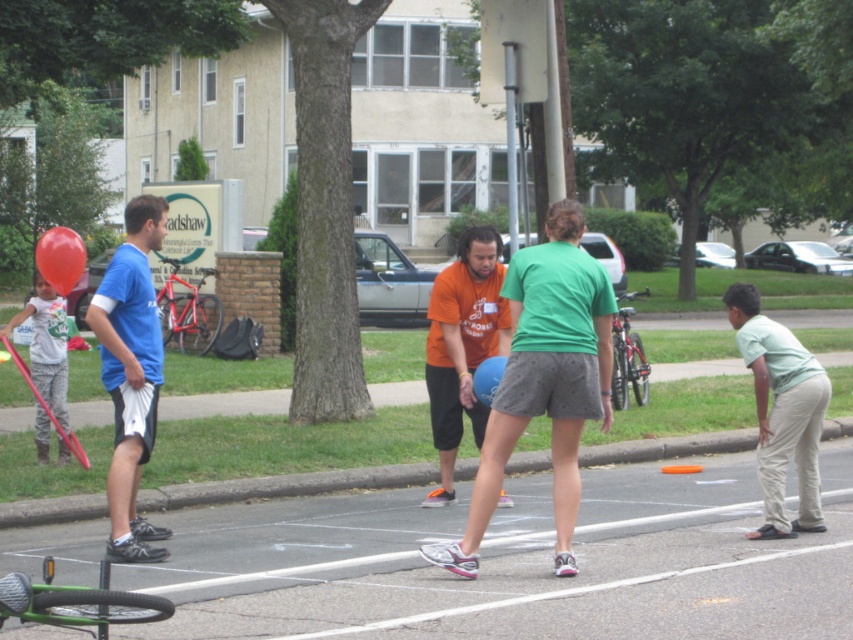
Who is shorter, light green cotton shirt at lower right or orange cotton t-shirt at center?

light green cotton shirt at lower right is shorter.

Does light green cotton shirt at lower right have a greater width compared to orange cotton t-shirt at center?

Correct, the width of light green cotton shirt at lower right exceeds that of orange cotton t-shirt at center.

Is point (811, 524) more distant than point (473, 392)?

No, (811, 524) is closer to viewer.

This screenshot has width=853, height=640. What are the coordinates of `light green cotton shirt at lower right` in the screenshot? It's located at (781, 412).

Which is in front, point (442, 413) or point (483, 371)?

Positioned in front is point (483, 371).

Is point (456, 355) farther from viewer compared to point (485, 394)?

Yes, it is.

Locate an element on the screen. orange cotton t-shirt at center is located at coordinates (462, 346).

Is point (761, 358) more distant than point (61, 246)?

No.

Can you confirm if light green cotton shirt at lower right is positioned above rubber balloon at left?

No.

Image resolution: width=853 pixels, height=640 pixels. What do you see at coordinates (781, 412) in the screenshot?
I see `light green cotton shirt at lower right` at bounding box center [781, 412].

At what (x,y) coordinates should I click in order to perform the action: click on light green cotton shirt at lower right. Please return your answer as a coordinate pair (x, y). Looking at the image, I should click on (781, 412).